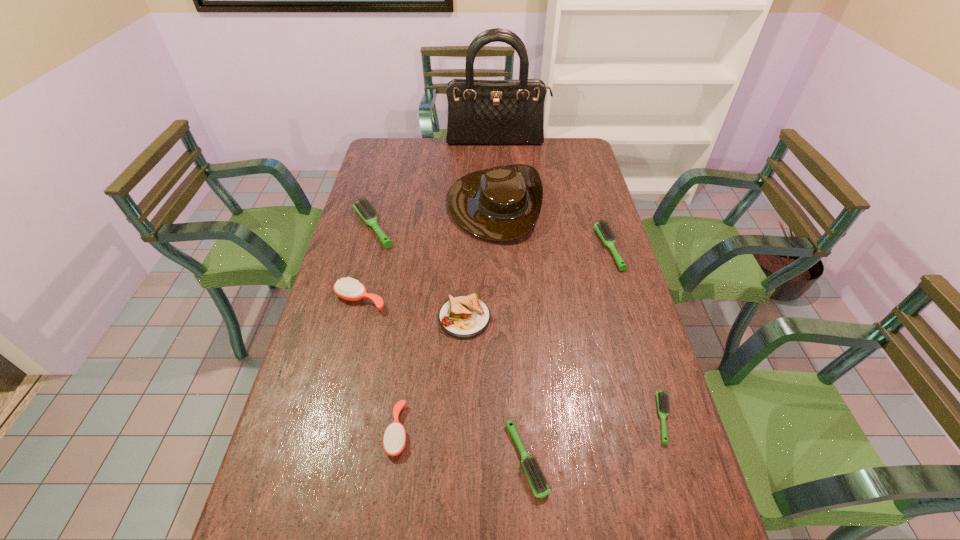
You are a GUI agent. You are given a task and a screenshot of the screen. Output one action in this format:
    pyautogui.click(x=<x>, y=<y>)
    Task: Click on the vacant position located 0.200m on the back of the right orange hairbrush
    
    Given the screenshot: What is the action you would take?
    pyautogui.click(x=410, y=339)

Locate an element on the screen. The height and width of the screenshot is (540, 960). free point located on the left of the fifth tallest hairbrush is located at coordinates (462, 459).

The height and width of the screenshot is (540, 960). Find the location of `vacant space located 0.350m on the back of the shortest object`. vacant space located 0.350m on the back of the shortest object is located at coordinates (624, 291).

What are the coordinates of `object that is positioned at the far edge` in the screenshot? It's located at (480, 112).

This screenshot has height=540, width=960. In order to click on handbag at the right edge in this screenshot , I will do `click(480, 112)`.

You are a GUI agent. You are given a task and a screenshot of the screen. Output one action in this format:
    pyautogui.click(x=<x>, y=<y>)
    Task: Click on the object that is at the far right corner
    Image resolution: width=960 pixels, height=540 pixels.
    Given the screenshot: What is the action you would take?
    pyautogui.click(x=480, y=112)

Locate an element on the screen. vacant space at the left edge of the desktop is located at coordinates (368, 265).

Locate an element on the screen. The image size is (960, 540). vacant region at the right edge is located at coordinates (591, 287).

The width and height of the screenshot is (960, 540). Find the location of `vacant space at the far right corner of the desktop`. vacant space at the far right corner of the desktop is located at coordinates (555, 147).

In order to click on vacant area between the leftmost light hairbrush and the third object from left to right in this screenshot , I will do `click(385, 328)`.